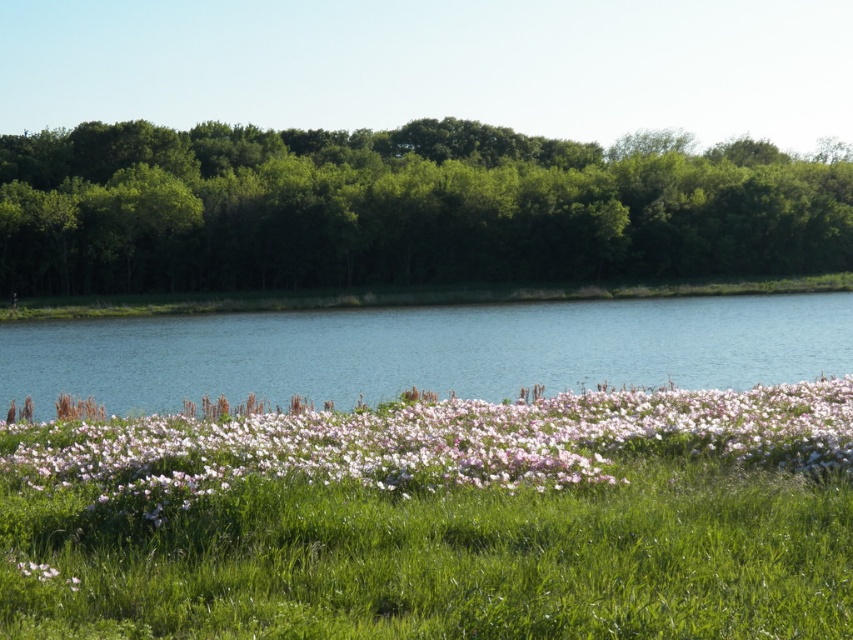
Question: Which point is farther to the camera?

Choices:
 (A) (173, 266)
 (B) (218, 362)
 (C) (99, 500)

Answer: (A)

Question: Does green leafy trees at upper center have a larger size compared to pink matte flowers at center?

Choices:
 (A) yes
 (B) no

Answer: (A)

Question: Is blue water at center to the left of pink matte flowers at center from the viewer's perspective?

Choices:
 (A) no
 (B) yes

Answer: (B)

Question: Is blue water at center positioned in front of pink matte flowers at center?

Choices:
 (A) yes
 (B) no

Answer: (B)

Question: Among these objects, which one is nearest to the camera?

Choices:
 (A) green leafy trees at upper center
 (B) blue water at center

Answer: (B)

Question: Which point appears farthest from the camera in this image?

Choices:
 (A) (753, 408)
 (B) (566, 140)
 (C) (10, 330)

Answer: (B)